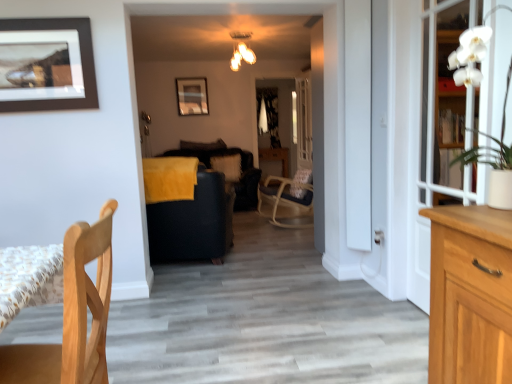
Question: Does velvet black couch at center have a larger size compared to brown matte picture frame at upper left, which ranks as the second picture frame in back-to-front order?

Choices:
 (A) no
 (B) yes

Answer: (B)

Question: From the image's perspective, is velvet black couch at center beneath brown matte picture frame at upper left, which ranks as the second picture frame in back-to-front order?

Choices:
 (A) no
 (B) yes

Answer: (B)

Question: From a real-world perspective, is velvet black couch at center beneath brown matte picture frame at upper left, which ranks as the second picture frame in back-to-front order?

Choices:
 (A) yes
 (B) no

Answer: (A)

Question: Is velvet black couch at center not within brown matte picture frame at upper left, which ranks as the second picture frame in back-to-front order?

Choices:
 (A) no
 (B) yes

Answer: (B)

Question: Is velvet black couch at center in front of brown matte picture frame at upper left, positioned as the first picture frame in front-to-back order?

Choices:
 (A) no
 (B) yes

Answer: (A)

Question: From a real-world perspective, is brown matte picture frame at upper left, which ranks as the second picture frame in back-to-front order, positioned above or below matte black picture frame at upper center, the first picture frame when ordered from back to front?

Choices:
 (A) below
 (B) above

Answer: (A)

Question: In the image, is brown matte picture frame at upper left, which appears as the 1th picture frame when ordered from the bottom, positioned in front of or behind matte black picture frame at upper center, the second picture frame ordered from the bottom?

Choices:
 (A) front
 (B) behind

Answer: (A)

Question: From their relative heights in the image, would you say brown matte picture frame at upper left, positioned as the first picture frame in front-to-back order, is taller or shorter than matte black picture frame at upper center, arranged as the 2th picture frame when viewed from the front?

Choices:
 (A) short
 (B) tall

Answer: (A)

Question: Does point (8, 79) appear closer or farther from the camera than point (190, 89)?

Choices:
 (A) closer
 (B) farther

Answer: (A)

Question: From a real-world perspective, is clear glass door at center, positioned as the 2th glass door in front-to-back order, positioned above or below velvet black couch at center?

Choices:
 (A) above
 (B) below

Answer: (A)

Question: Considering their positions, is clear glass door at center, positioned as the 2th glass door in front-to-back order, located in front of or behind velvet black couch at center?

Choices:
 (A) front
 (B) behind

Answer: (B)

Question: In terms of size, does clear glass door at center, positioned as the first glass door in back-to-front order, appear bigger or smaller than velvet black couch at center?

Choices:
 (A) big
 (B) small

Answer: (B)

Question: Considering the relative positions of clear glass door at center, positioned as the first glass door in back-to-front order, and velvet black couch at center in the image provided, is clear glass door at center, positioned as the first glass door in back-to-front order, to the left or to the right of velvet black couch at center?

Choices:
 (A) left
 (B) right

Answer: (B)

Question: Considering the positions of point (305, 144) and point (216, 170), is point (305, 144) closer or farther from the camera than point (216, 170)?

Choices:
 (A) closer
 (B) farther

Answer: (B)

Question: From a real-world perspective, is clear glass door at center, positioned as the 2th glass door in front-to-back order, physically located above or below white fluffy pillow at center?

Choices:
 (A) below
 (B) above

Answer: (B)